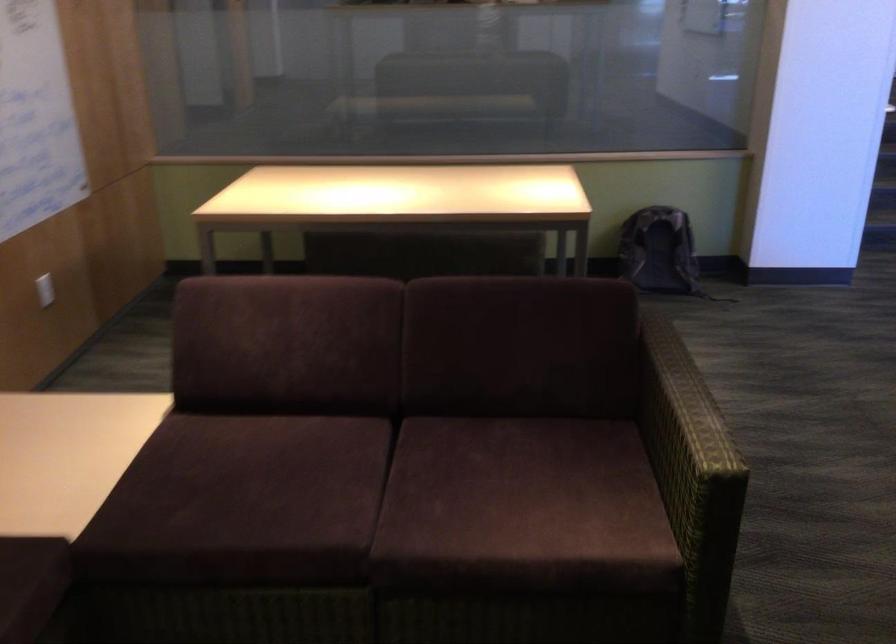
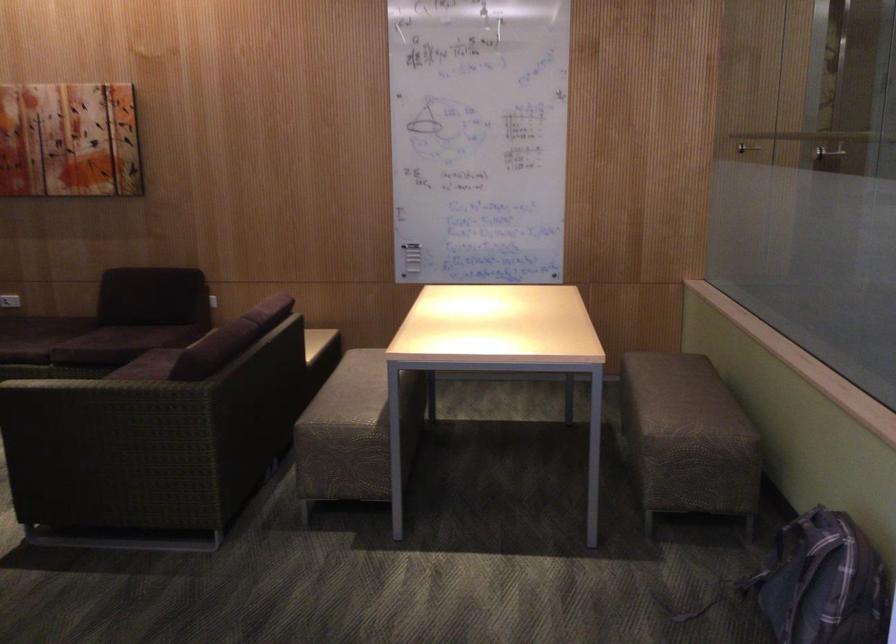
Where in the second image is the point corresponding to point (700, 275) from the first image?

(823, 583)